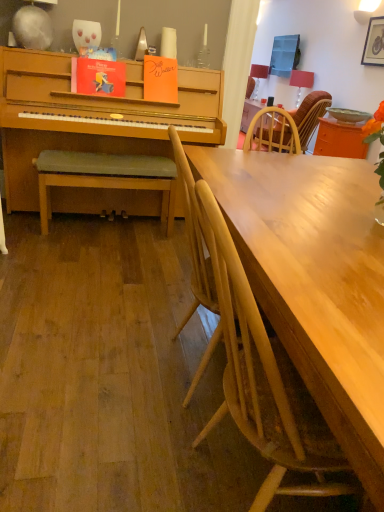
Question: Is green matte bowl at upper right positioned with its back to matte red lampshade at upper right, which is counted as the 2th lamp, starting from the back?

Choices:
 (A) no
 (B) yes

Answer: (A)

Question: Does green matte bowl at upper right appear on the right side of matte red lampshade at upper right, which appears as the 2th lamp when viewed from the left?

Choices:
 (A) no
 (B) yes

Answer: (B)

Question: Is matte red lampshade at upper right, which appears as the first lamp when viewed from the front, inside green matte bowl at upper right?

Choices:
 (A) no
 (B) yes

Answer: (A)

Question: Does green matte bowl at upper right turn towards matte red lampshade at upper right, which appears as the 2th lamp when viewed from the left?

Choices:
 (A) yes
 (B) no

Answer: (B)

Question: Considering the relative positions of green matte bowl at upper right and matte red lampshade at upper right, which is counted as the 2th lamp, starting from the back, in the image provided, is green matte bowl at upper right to the left of matte red lampshade at upper right, which is counted as the 2th lamp, starting from the back, from the viewer's perspective?

Choices:
 (A) no
 (B) yes

Answer: (A)

Question: Is the depth of green matte bowl at upper right greater than that of matte red lampshade at upper right, which is counted as the 1th lamp, starting from the right?

Choices:
 (A) yes
 (B) no

Answer: (B)

Question: Is green fabric bench at left behind light wood chair at center, which is the 3th chair from right to left?

Choices:
 (A) no
 (B) yes

Answer: (B)

Question: Is green fabric bench at left not near light wood chair at center, positioned as the 2th chair in front-to-back order?

Choices:
 (A) no
 (B) yes

Answer: (B)

Question: Can you confirm if green fabric bench at left is taller than light wood chair at center, marked as the second chair in a bottom-to-top arrangement?

Choices:
 (A) no
 (B) yes

Answer: (A)

Question: From a real-world perspective, does green fabric bench at left stand above light wood chair at center, which is the 3th chair from right to left?

Choices:
 (A) no
 (B) yes

Answer: (A)

Question: Would you say green fabric bench at left contains light wood chair at center, marked as the second chair in a bottom-to-top arrangement?

Choices:
 (A) no
 (B) yes

Answer: (A)

Question: Is green fabric bench at left bigger than light wood chair at center, acting as the second chair starting from the back?

Choices:
 (A) yes
 (B) no

Answer: (B)

Question: Is light wood chair at center, the 1th chair in the bottom-to-top sequence, shorter than green matte bowl at upper right?

Choices:
 (A) no
 (B) yes

Answer: (A)